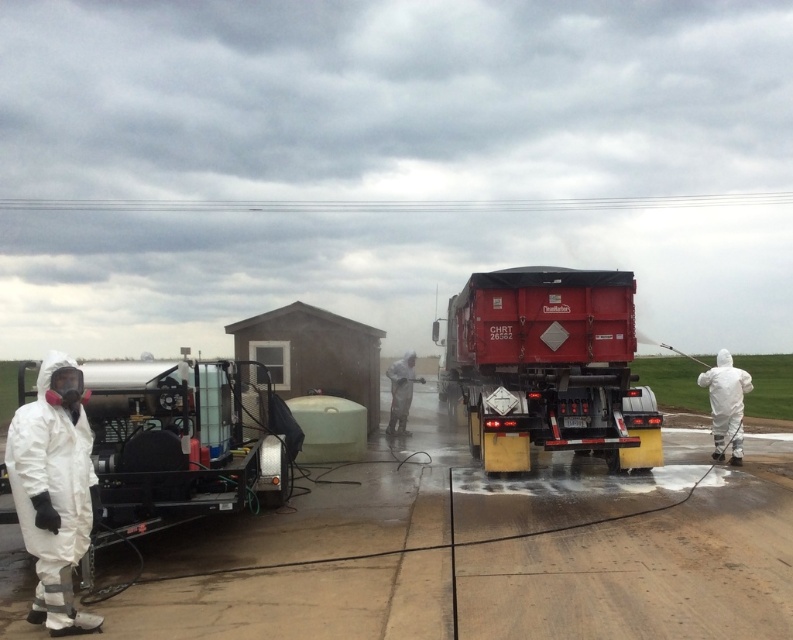
Is white matte trailer truck at left wider than white matte hazmat suit at center?

Yes, white matte trailer truck at left is wider than white matte hazmat suit at center.

Does point (10, 476) come farther from viewer compared to point (400, 365)?

No, it is in front of (400, 365).

Is point (194, 374) farther from camera compared to point (393, 369)?

That is False.

Locate an element on the screen. Image resolution: width=793 pixels, height=640 pixels. white matte trailer truck at left is located at coordinates (182, 444).

Based on the photo, how distant is smooth concrete tarmac at center from red matte trailer truck at center?

smooth concrete tarmac at center and red matte trailer truck at center are 7.37 feet apart.

Between smooth concrete tarmac at center and red matte trailer truck at center, which one is positioned higher?

red matte trailer truck at center is higher up.

Is point (236, 536) farther from camera compared to point (504, 392)?

That is False.

Identify the location of smooth concrete tarmac at center. The height and width of the screenshot is (640, 793). (485, 552).

Can you confirm if white matte/soft hazmat suit at left is smaller than white matte hazmat suit at center?

Actually, white matte/soft hazmat suit at left might be larger than white matte hazmat suit at center.

Between point (82, 422) and point (403, 381), which one is positioned in front?

Point (82, 422) is in front.

Find the location of `white matte/soft hazmat suit at left`. white matte/soft hazmat suit at left is located at coordinates (54, 490).